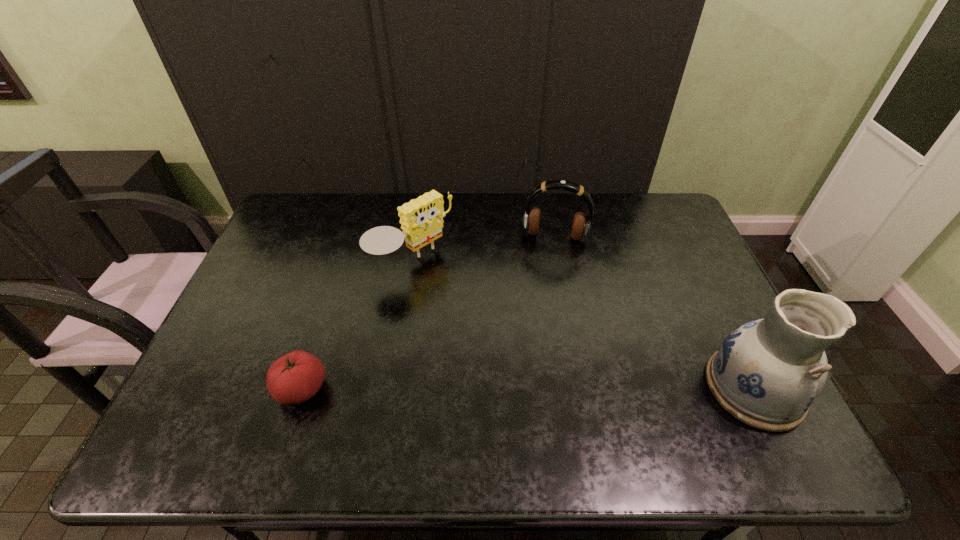
This screenshot has width=960, height=540. Find the location of `vacant space located on the ear cup of the second object from right to left`. vacant space located on the ear cup of the second object from right to left is located at coordinates (540, 324).

You are a GUI agent. You are given a task and a screenshot of the screen. Output one action in this format:
    pyautogui.click(x=<x>, y=<y>)
    Task: Click on the vacant region located on the front-facing side of the third object from right to left
    This screenshot has height=540, width=960.
    Given the screenshot: What is the action you would take?
    pyautogui.click(x=466, y=305)

Locate an element on the screen. Image resolution: width=960 pixels, height=540 pixels. free space located on the front-facing side of the third object from right to left is located at coordinates (500, 334).

Locate an element on the screen. The width and height of the screenshot is (960, 540). vacant space located on the front-facing side of the third object from right to left is located at coordinates (514, 345).

Locate an element on the screen. object that is at the far edge is located at coordinates (581, 224).

I want to click on tomato located in the near edge section of the desktop, so click(x=294, y=378).

What are the coordinates of `pottery located in the near edge section of the desktop` in the screenshot? It's located at (767, 373).

Find the location of a particular element. This screenshot has height=540, width=960. object at the right edge is located at coordinates (767, 373).

This screenshot has height=540, width=960. Find the location of `object that is at the near right corner`. object that is at the near right corner is located at coordinates (767, 373).

This screenshot has width=960, height=540. In order to click on vacant area at the far edge in this screenshot , I will do `click(445, 221)`.